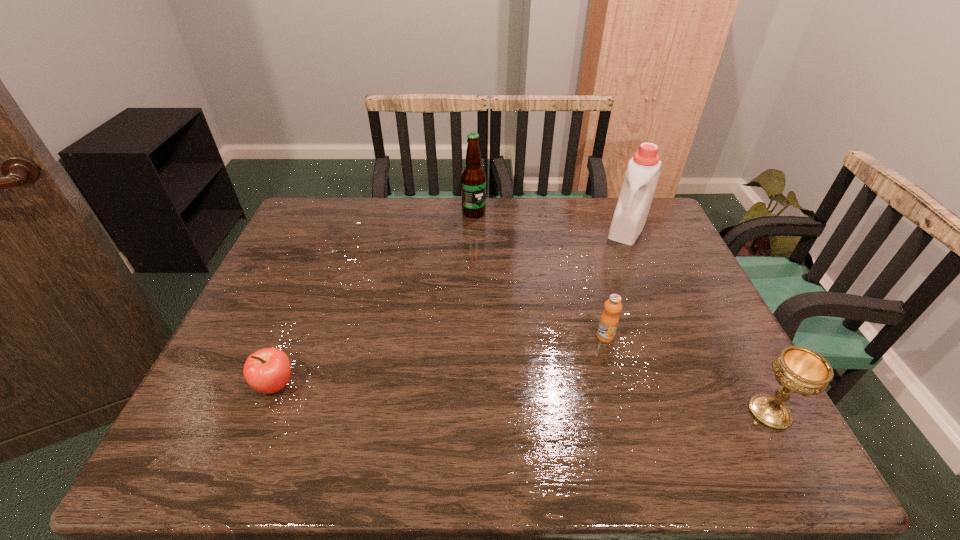
The width and height of the screenshot is (960, 540). I want to click on beer bottle present at the far edge, so click(x=473, y=177).

Image resolution: width=960 pixels, height=540 pixels. I want to click on apple at the near edge, so click(268, 370).

This screenshot has width=960, height=540. In order to click on chalice that is at the near edge in this screenshot , I will do `click(801, 370)`.

I want to click on object present at the left edge, so click(x=268, y=370).

Locate an element on the screen. chalice that is at the right edge is located at coordinates (801, 370).

Find the location of a particular element. The width and height of the screenshot is (960, 540). detergent positioned at the right edge is located at coordinates (637, 191).

This screenshot has width=960, height=540. In order to click on object present at the near left corner in this screenshot , I will do `click(268, 370)`.

Find the location of a particular element. object that is at the far right corner is located at coordinates (637, 191).

Where is `object at the near right corner`? Image resolution: width=960 pixels, height=540 pixels. object at the near right corner is located at coordinates (801, 370).

In the image, there is a desktop. Identify the location of vacant space at the far edge. The height and width of the screenshot is (540, 960). (512, 203).